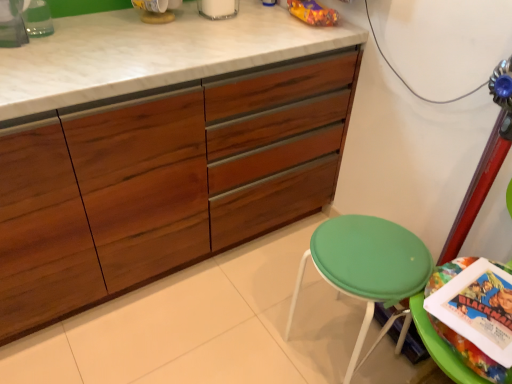
Question: Could you tell me if green plastic stool at lower right is turned towards wooden cabinet at center?

Choices:
 (A) yes
 (B) no

Answer: (B)

Question: Is wooden cabinet at center at the back of green plastic stool at lower right?

Choices:
 (A) no
 (B) yes

Answer: (A)

Question: From a real-world perspective, is green plastic stool at lower right under wooden cabinet at center?

Choices:
 (A) yes
 (B) no

Answer: (B)

Question: Is green plastic stool at lower right not within wooden cabinet at center?

Choices:
 (A) no
 (B) yes

Answer: (B)

Question: Is green plastic stool at lower right placed right next to wooden cabinet at center?

Choices:
 (A) yes
 (B) no

Answer: (B)

Question: Looking at their shapes, would you say green plastic stool at lower right is wider or thinner than green fabric stool at lower right?

Choices:
 (A) wide
 (B) thin

Answer: (B)

Question: Is green plastic stool at lower right to the left or to the right of green fabric stool at lower right in the image?

Choices:
 (A) left
 (B) right

Answer: (B)

Question: Does point (435, 326) appear closer or farther from the camera than point (431, 271)?

Choices:
 (A) closer
 (B) farther

Answer: (A)

Question: From a real-world perspective, is green plastic stool at lower right positioned above or below green fabric stool at lower right?

Choices:
 (A) above
 (B) below

Answer: (A)

Question: Based on their sizes in the image, would you say wooden cabinet at center is bigger or smaller than green fabric stool at lower right?

Choices:
 (A) small
 (B) big

Answer: (B)

Question: From a real-world perspective, is wooden cabinet at center above or below green fabric stool at lower right?

Choices:
 (A) above
 (B) below

Answer: (A)

Question: Choose the correct answer: Is wooden cabinet at center inside green fabric stool at lower right or outside it?

Choices:
 (A) inside
 (B) outside

Answer: (B)

Question: Is wooden cabinet at center wider or thinner than green fabric stool at lower right?

Choices:
 (A) wide
 (B) thin

Answer: (A)

Question: Is green fabric stool at lower right bigger or smaller than green plastic stool at lower right?

Choices:
 (A) small
 (B) big

Answer: (B)

Question: Considering their positions, is green fabric stool at lower right located in front of or behind green plastic stool at lower right?

Choices:
 (A) front
 (B) behind

Answer: (B)